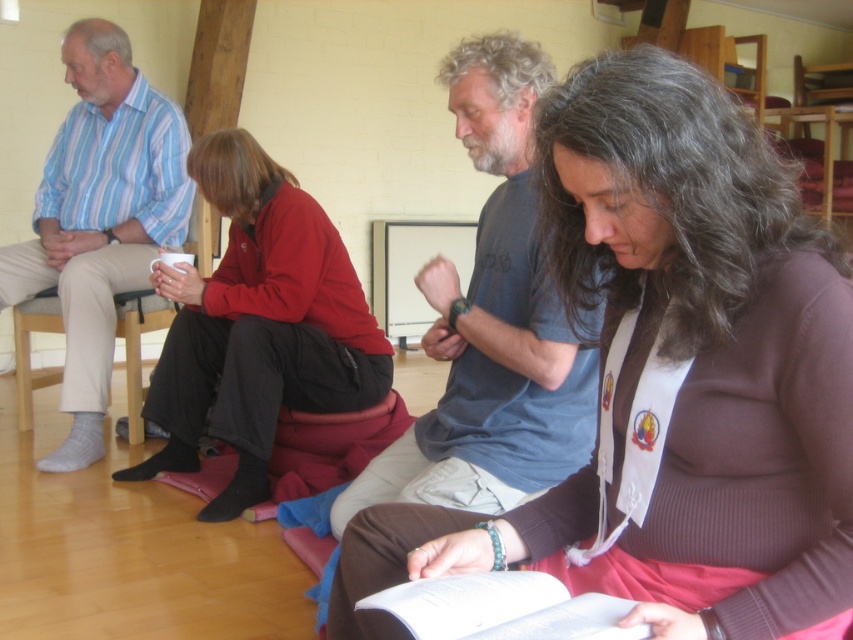
Can you confirm if brown ribbed sweater at center is positioned to the left of striped cotton shirt at left?

In fact, brown ribbed sweater at center is to the right of striped cotton shirt at left.

Can you confirm if brown ribbed sweater at center is positioned below striped cotton shirt at left?

Yes.

Which is behind, point (402, 568) or point (16, 248)?

Point (16, 248)

The height and width of the screenshot is (640, 853). I want to click on brown ribbed sweater at center, so pyautogui.click(x=670, y=380).

Is brown ribbed sweater at center shorter than red fleece jacket at center?

Indeed, brown ribbed sweater at center has a lesser height compared to red fleece jacket at center.

Is brown ribbed sweater at center taller than red fleece jacket at center?

Incorrect, brown ribbed sweater at center's height is not larger of red fleece jacket at center's.

The image size is (853, 640). Find the location of `brown ribbed sweater at center`. brown ribbed sweater at center is located at coordinates (670, 380).

Identify the location of brown ribbed sweater at center. (670, 380).

Between brown ribbed sweater at center and dark blue t-shirt at center, which one is positioned lower?

brown ribbed sweater at center is lower down.

Between brown ribbed sweater at center and dark blue t-shirt at center, which one has less height?

Standing shorter between the two is brown ribbed sweater at center.

In order to click on brown ribbed sweater at center in this screenshot , I will do `click(670, 380)`.